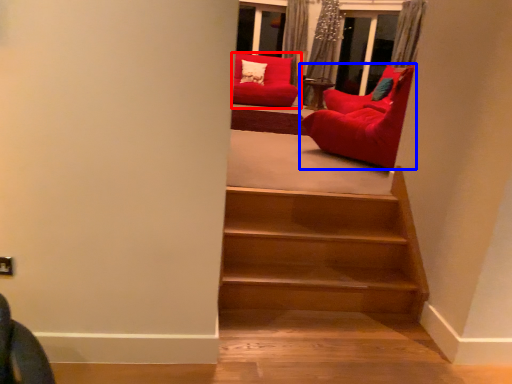
Question: Which of the following is the closest to the observer, chair (highlighted by a red box) or chair (highlighted by a blue box)?

Choices:
 (A) chair
 (B) chair

Answer: (B)